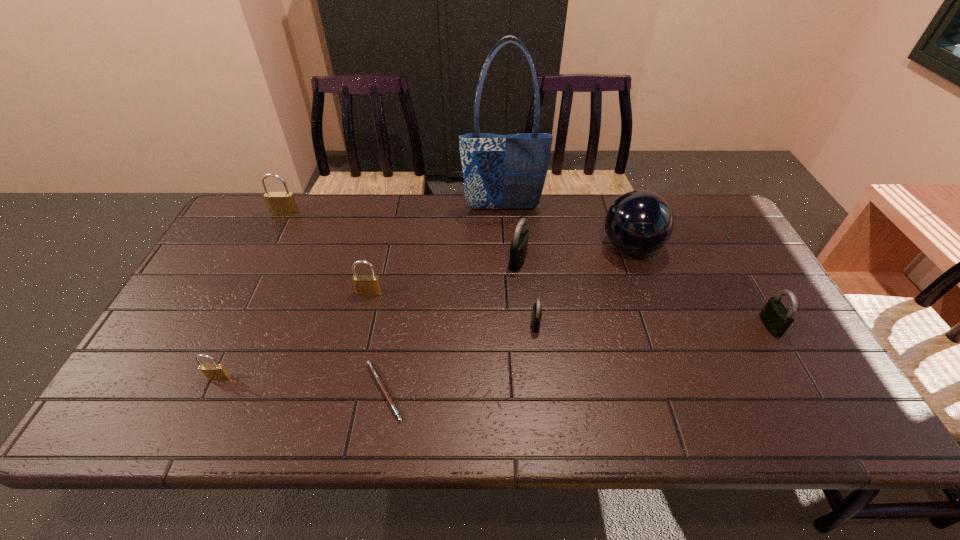
Locate an element on the screen. The height and width of the screenshot is (540, 960). shopping bag is located at coordinates (500, 171).

At what (x,y) coordinates should I click in order to perform the action: click on bowling ball. Please return your answer as a coordinate pair (x, y). The image size is (960, 540). Looking at the image, I should click on (639, 222).

At what (x,y) coordinates should I click in order to perform the action: click on the second tallest object. Please return your answer as a coordinate pair (x, y). This screenshot has height=540, width=960. Looking at the image, I should click on (639, 222).

You are a GUI agent. You are given a task and a screenshot of the screen. Output one action in this format:
    pyautogui.click(x=<x>, y=<y>)
    Task: Click on the biggest brass padlock
    
    Given the screenshot: What is the action you would take?
    pyautogui.click(x=279, y=203)

The height and width of the screenshot is (540, 960). I want to click on the farthest brass padlock, so click(279, 203).

Locate an element on the screen. the farthest black padlock is located at coordinates (518, 250).

Where is `the second farthest padlock`? The width and height of the screenshot is (960, 540). the second farthest padlock is located at coordinates point(518,250).

I want to click on the rightmost padlock, so click(775, 317).

Locate an element on the screen. The height and width of the screenshot is (540, 960). the rightmost black padlock is located at coordinates (775, 317).

Where is `the fifth nearest object`? Image resolution: width=960 pixels, height=540 pixels. the fifth nearest object is located at coordinates (364, 284).